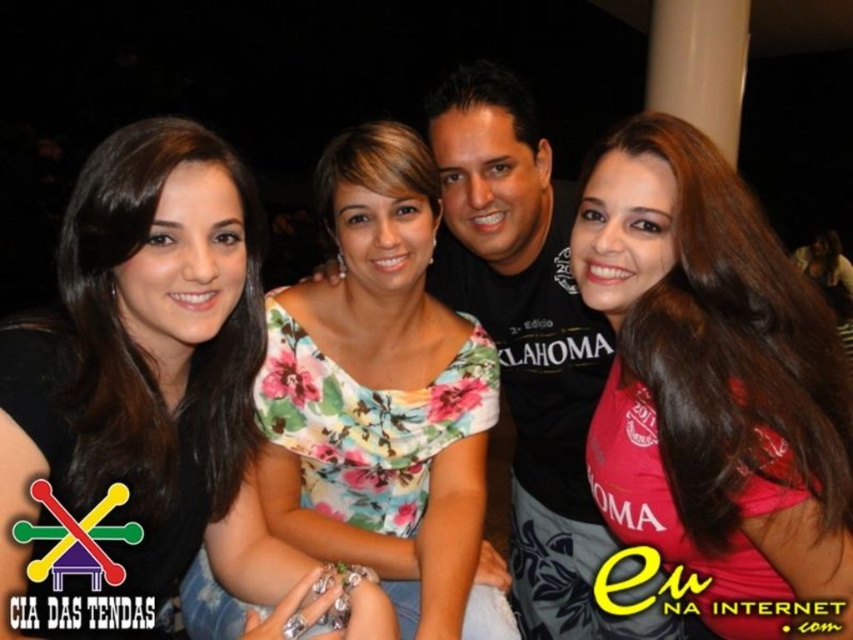
Question: Which of these objects is positioned closest to the floral fabric dress at center?

Choices:
 (A) pink jersey at right
 (B) floral fabric dress at upper center

Answer: (B)

Question: Is floral fabric dress at upper center above floral fabric dress at center?

Choices:
 (A) no
 (B) yes

Answer: (A)

Question: Which of the following is the farthest from the observer?

Choices:
 (A) floral fabric dress at upper center
 (B) pink jersey at right

Answer: (B)

Question: Is floral fabric dress at upper center to the right of pink jersey at right from the viewer's perspective?

Choices:
 (A) no
 (B) yes

Answer: (A)

Question: Is floral fabric dress at upper center bigger than pink jersey at right?

Choices:
 (A) yes
 (B) no

Answer: (A)

Question: Which point is farther to the camera?

Choices:
 (A) (579, 253)
 (B) (148, 369)

Answer: (A)